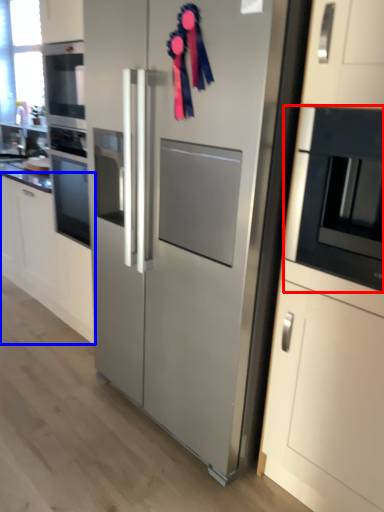
Question: Which point is closer to the camera, microwave oven (highlighted by a red box) or cabinetry (highlighted by a blue box)?

Choices:
 (A) microwave oven
 (B) cabinetry

Answer: (A)